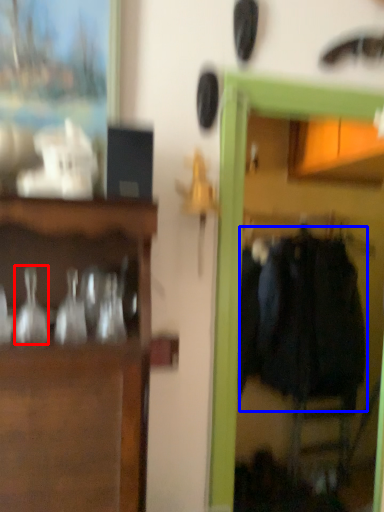
Question: Among these objects, which one is farthest to the camera, glass vase (highlighted by a red box) or clothing (highlighted by a blue box)?

Choices:
 (A) glass vase
 (B) clothing

Answer: (B)